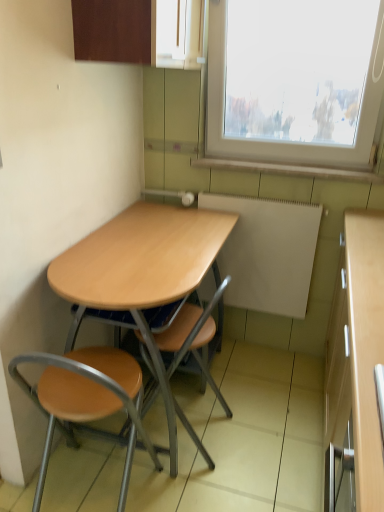
Measure the distance between point (147, 42) and camera.

The depth of point (147, 42) is 4.65 feet.

At what (x,y) coordinates should I click in order to perform the action: click on green tile at upper right. Please return your answer as a coordinate pair (x, y). Looking at the image, I should click on (289, 169).

The image size is (384, 512). What do you see at coordinates (87, 399) in the screenshot?
I see `wooden seat at lower left, the second chair in the right-to-left sequence` at bounding box center [87, 399].

Find the location of a particular element. This screenshot has height=512, width=384. matte wood cabinet at upper center is located at coordinates (112, 30).

Can you confirm if wooden seat at lower left, the second chair in the right-to-left sequence, is smaller than wooden seat at center, which is the first chair from right to left?

Yes.

How distant is wooden seat at lower left, the second chair in the right-to-left sequence, from wooden seat at center, placed as the second chair when sorted from left to right?

27.53 centimeters.

From a real-world perspective, is wooden seat at lower left, the 1th chair positioned from the left, positioned above or below wooden seat at center, which is the first chair from right to left?

wooden seat at lower left, the 1th chair positioned from the left, is below wooden seat at center, which is the first chair from right to left.

From the image's perspective, which one is positioned lower, wooden seat at lower left, the second chair in the right-to-left sequence, or wooden seat at center, which is the first chair from right to left?

wooden seat at lower left, the second chair in the right-to-left sequence, appears lower in the image.

From a real-world perspective, is wooden seat at center, placed as the second chair when sorted from left to right, on top of wooden table at center?

No.

What's the angular difference between wooden seat at center, placed as the second chair when sorted from left to right, and wooden table at center's facing directions?

They differ by 1.23 degrees in their facing directions.

Is wooden seat at center, placed as the second chair when sorted from left to right, not close to wooden table at center?

Actually, wooden seat at center, placed as the second chair when sorted from left to right, and wooden table at center are a little close together.

Considering the sizes of objects wooden seat at center, which is the first chair from right to left, and wooden table at center in the image provided, who is shorter, wooden seat at center, which is the first chair from right to left, or wooden table at center?

Standing shorter between the two is wooden seat at center, which is the first chair from right to left.

Is white matte radiator at center shorter than matte wood cabinet at upper center?

No.

Which point is more forward, (200, 295) or (98, 15)?

The point (98, 15) is closer to the camera.

Identify the location of cabinetry that appears in front of the white matte radiator at center. This screenshot has height=512, width=384. (112, 30).

How far apart are green tile at upper right and wooden seat at center, placed as the second chair when sorted from left to right?

green tile at upper right is 37.58 inches from wooden seat at center, placed as the second chair when sorted from left to right.

Which object is more forward, green tile at upper right or wooden seat at center, placed as the second chair when sorted from left to right?

wooden seat at center, placed as the second chair when sorted from left to right.

Which object is thinner, green tile at upper right or wooden seat at center, which is the first chair from right to left?

green tile at upper right.

Considering the relative sizes of green tile at upper right and wooden seat at center, placed as the second chair when sorted from left to right, in the image provided, is green tile at upper right smaller than wooden seat at center, placed as the second chair when sorted from left to right,?

Yes, green tile at upper right is smaller than wooden seat at center, placed as the second chair when sorted from left to right.

Which is more to the left, wooden table at center or white matte radiator at center?

Positioned to the left is wooden table at center.

Can you confirm if wooden table at center is bigger than white matte radiator at center?

Correct, wooden table at center is larger in size than white matte radiator at center.

In the scene shown: What's the angular difference between wooden table at center and white matte radiator at center's facing directions?

The angular difference between wooden table at center and white matte radiator at center is 89.7 degrees.

Is wooden table at center next to white matte radiator at center?

wooden table at center is not next to white matte radiator at center, and they're not touching.

Which is farther from the camera, (x=234, y=164) or (x=225, y=286)?

The point (x=225, y=286) is behind.

From the image's perspective, which one is positioned higher, green tile at upper right or wooden table at center?

green tile at upper right.

Is green tile at upper right not within wooden table at center?

Yes, green tile at upper right is outside of wooden table at center.

Can you confirm if wooden seat at lower left, the 1th chair positioned from the left, is bigger than green tile at upper right?

Yes, wooden seat at lower left, the 1th chair positioned from the left, is bigger than green tile at upper right.

Consider the image. Which of these two, wooden seat at lower left, the second chair in the right-to-left sequence, or green tile at upper right, stands taller?

wooden seat at lower left, the second chair in the right-to-left sequence.

Image resolution: width=384 pixels, height=512 pixels. Identify the location of the 2nd chair directly beneath the green tile at upper right (from a real-world perspective). (87, 399).

This screenshot has height=512, width=384. I want to click on chair below the wooden seat at center, which is the first chair from right to left (from a real-world perspective), so click(x=87, y=399).

Identify the location of table lying above the wooden seat at center, which is the first chair from right to left (from the image's perspective). The width and height of the screenshot is (384, 512). (147, 278).

When comparing their distances from white matte radiator at center, does wooden table at center or green tile at upper right seem closer?

green tile at upper right is closer to white matte radiator at center.

Which object lies further to the anchor point wooden seat at center, which is the first chair from right to left, white matte radiator at center or matte wood cabinet at upper center?

matte wood cabinet at upper center.

Based on their spatial positions, is wooden seat at center, which is the first chair from right to left, or white matte radiator at center further from green tile at upper right?

Based on the image, wooden seat at center, which is the first chair from right to left, appears to be further to green tile at upper right.

Which object lies nearer to the anchor point matte wood cabinet at upper center, wooden table at center or white matte radiator at center?

wooden table at center is positioned closer to the anchor matte wood cabinet at upper center.

From the image, which object appears to be nearer to matte wood cabinet at upper center, green tile at upper right or white matte radiator at center?

Among the two, green tile at upper right is located nearer to matte wood cabinet at upper center.

Considering their positions, is wooden seat at center, which is the first chair from right to left, positioned closer to wooden seat at lower left, the 1th chair positioned from the left, than wooden table at center?

wooden seat at center, which is the first chair from right to left, is closer to wooden seat at lower left, the 1th chair positioned from the left.

Estimate the real-world distances between objects in this image. Which object is further from wooden seat at center, which is the first chair from right to left, wooden table at center or white matte radiator at center?

Among the two, white matte radiator at center is located further to wooden seat at center, which is the first chair from right to left.

Considering their positions, is matte wood cabinet at upper center positioned further to wooden table at center than wooden seat at center, placed as the second chair when sorted from left to right?

Based on the image, matte wood cabinet at upper center appears to be further to wooden table at center.

Image resolution: width=384 pixels, height=512 pixels. What are the coordinates of `appliance between matte wood cabinet at upper center and wooden table at center vertically` in the screenshot? It's located at (267, 253).

Where is `table that lies between matte wood cabinet at upper center and wooden seat at lower left, the 1th chair positioned from the left, from top to bottom`? table that lies between matte wood cabinet at upper center and wooden seat at lower left, the 1th chair positioned from the left, from top to bottom is located at coordinates (147, 278).

What are the coordinates of `window sill between matte wood cabinet at upper center and wooden seat at center, which is the first chair from right to left, in the vertical direction` in the screenshot? It's located at (289, 169).

Identify the location of chair between matte wood cabinet at upper center and wooden seat at lower left, the 1th chair positioned from the left, vertically. This screenshot has height=512, width=384. (192, 338).